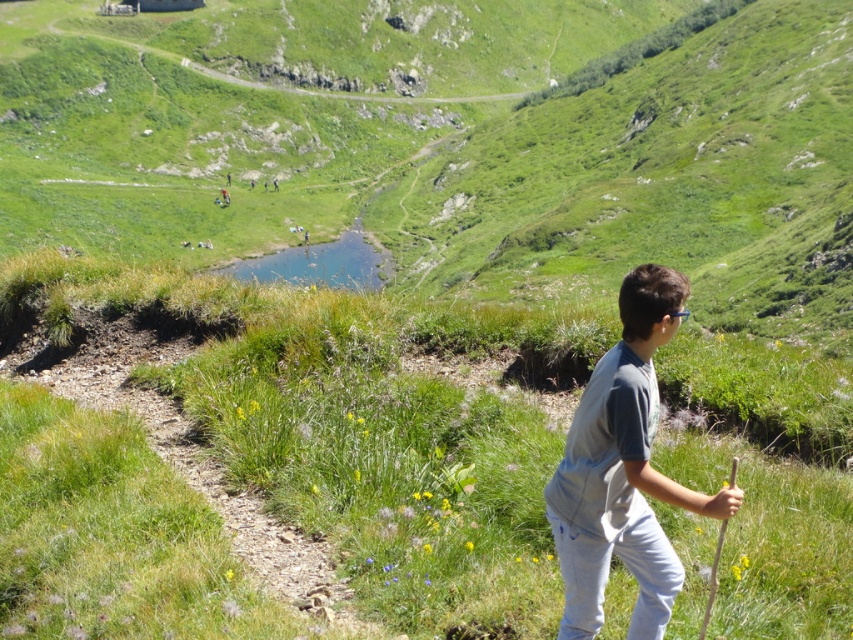
Question: Does green grassy at center have a greater width compared to gray cotton shirt at center?

Choices:
 (A) no
 (B) yes

Answer: (B)

Question: Does green grassy at center appear under gray cotton shirt at center?

Choices:
 (A) yes
 (B) no

Answer: (B)

Question: Is green grassy at center wider than gray cotton shirt at center?

Choices:
 (A) no
 (B) yes

Answer: (B)

Question: Which point is farther to the camera?

Choices:
 (A) (448, 531)
 (B) (590, 520)

Answer: (A)

Question: Which point appears closest to the camera in this image?

Choices:
 (A) (596, 545)
 (B) (300, 387)

Answer: (A)

Question: Among these objects, which one is nearest to the camera?

Choices:
 (A) green grassy at center
 (B) gray cotton shirt at center

Answer: (B)